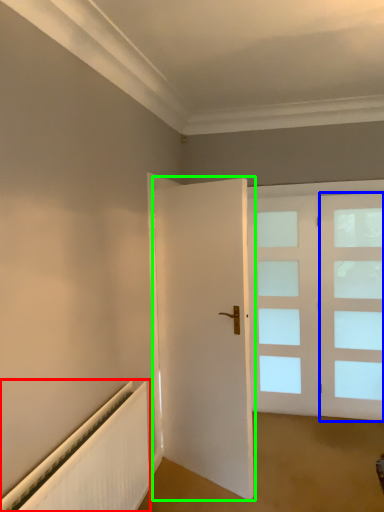
Question: Which is farther away from radiator (highlighted by a red box)? window (highlighted by a blue box) or door (highlighted by a green box)?

Choices:
 (A) window
 (B) door

Answer: (A)